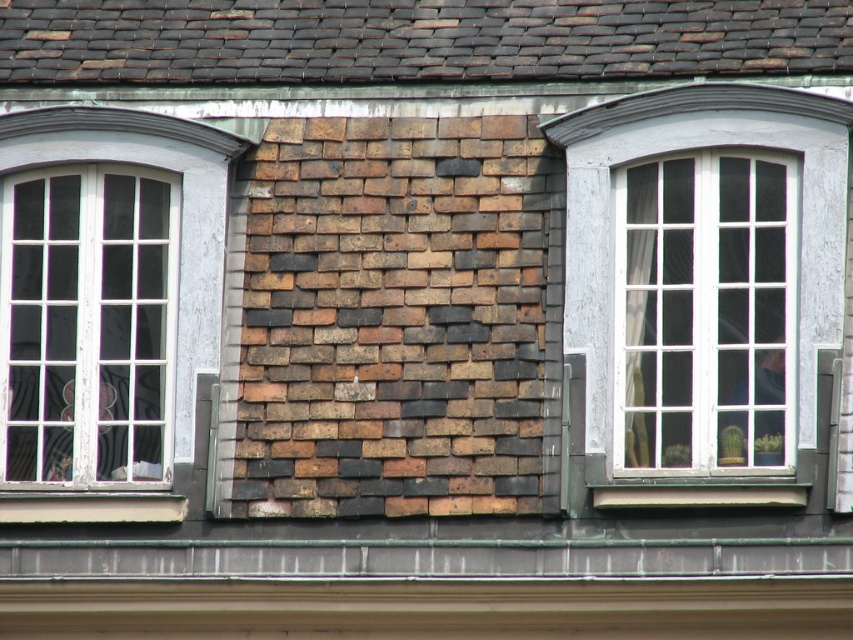
You are standing in front of the building and notice two white elements on the wall. Which one is closer to you, the white wooden window at left or the white painted wood at lower center?

The white wooden window at left is closer to you than the white painted wood at lower center.

You are an architect assessing the building facade. You need to install a new decorative panel between the white wood window at center and the white painted wood at lower center. Which object has a greater width to determine where to place the panel?

The white wood window at center has a greater width than the white painted wood at lower center, so the panel should be placed near the wider window to maintain symmetry.